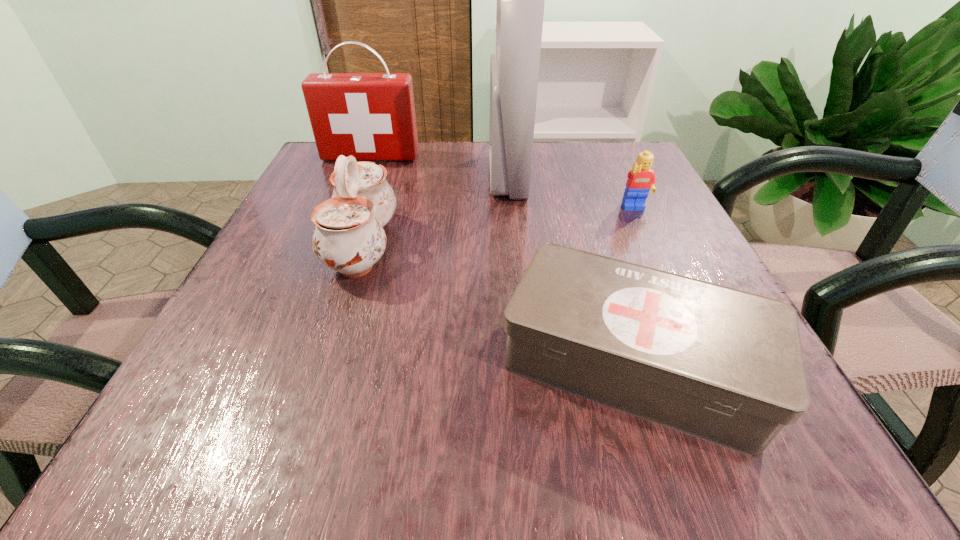
Locate an element on the screen. the tallest first-aid kit is located at coordinates (514, 70).

Locate an element on the screen. the leftmost first-aid kit is located at coordinates (371, 116).

The image size is (960, 540). In order to click on the second shortest first-aid kit in this screenshot , I will do `click(371, 116)`.

You are a GUI agent. You are given a task and a screenshot of the screen. Output one action in this format:
    pyautogui.click(x=<x>, y=<y>)
    Task: Click on the third shortest object
    The image size is (960, 540).
    Given the screenshot: What is the action you would take?
    pyautogui.click(x=349, y=237)

This screenshot has width=960, height=540. I want to click on the fourth tallest object, so click(x=641, y=180).

Find the location of `the shortest object`. the shortest object is located at coordinates (724, 365).

Identify the location of the shortest first-aid kit. (724, 365).

Where is `blank space located 0.320m on the front-facing side of the tallest object`? The height and width of the screenshot is (540, 960). blank space located 0.320m on the front-facing side of the tallest object is located at coordinates (343, 176).

Where is `blank space located 0.330m on the front-facing side of the tallest object`? blank space located 0.330m on the front-facing side of the tallest object is located at coordinates (338, 176).

Identify the location of free space located 0.390m on the front-facing side of the tallest object. The height and width of the screenshot is (540, 960). (310, 176).